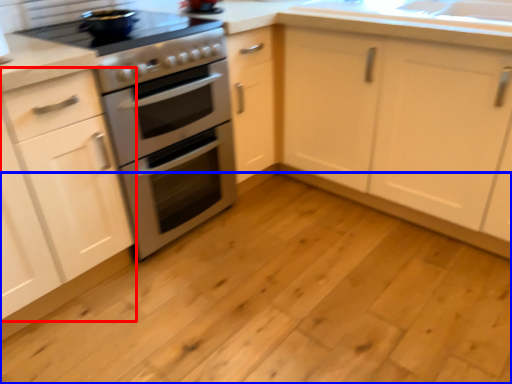
Question: Which object is further to the camera taking this photo, cabinetry (highlighted by a red box) or plain (highlighted by a blue box)?

Choices:
 (A) cabinetry
 (B) plain

Answer: (A)